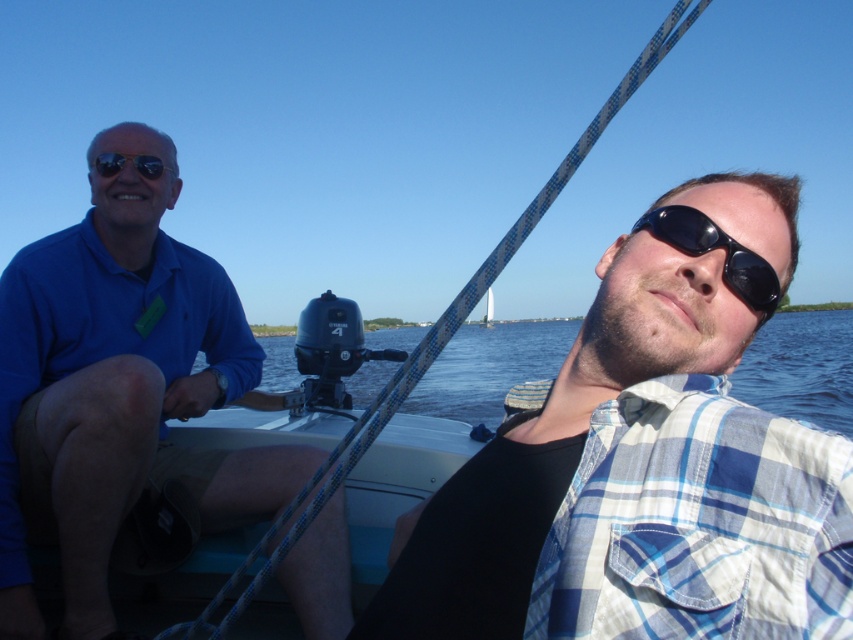
You are a photographer trying to capture the best shot of the two points on the motorboat. Which point, point (x=260, y=339) or point (x=163, y=164), is closer to you?

Point (x=260, y=339) is closer to you because it is further to the viewer than point (x=163, y=164).

You are a photographer trying to capture a closeup of the blue plaid shirt at center and the matte black sunglasses at upper left. Since you want both subjects to be in focus, which one should you adjust your camera focus on first, the one closer to you or the one further away?

The blue plaid shirt at center has a greater height compared to matte black sunglasses at upper left, so it is likely closer to you. Therefore, you should focus on the blue plaid shirt at center first to ensure both are in focus.

You are a photographer trying to capture the blue plaid shirt at center and the blue water at center in a single shot. Which object should you focus on first to ensure both are in the frame?

The blue plaid shirt at center is in front of the blue water at center, so you should focus on the blue plaid shirt at center first to ensure both are in the frame.